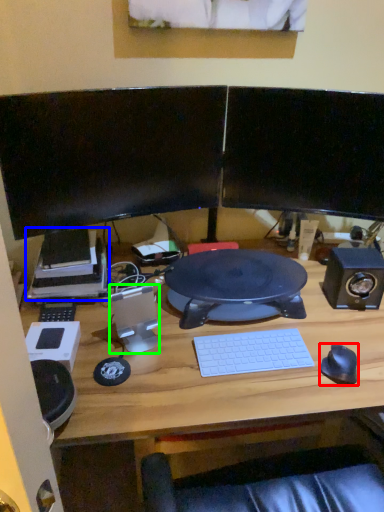
Question: Based on their relative distances, which object is farther from mouse (highlighted by a red box)? Choose from printer (highlighted by a blue box) and speaker (highlighted by a green box).

Choices:
 (A) printer
 (B) speaker

Answer: (A)